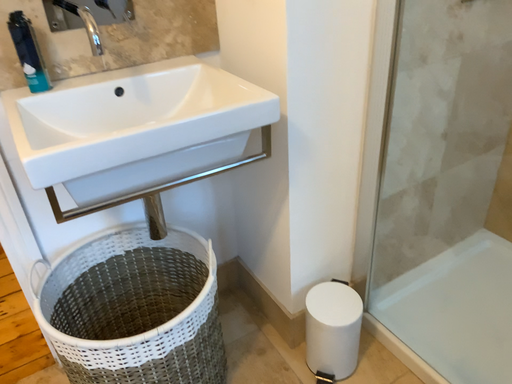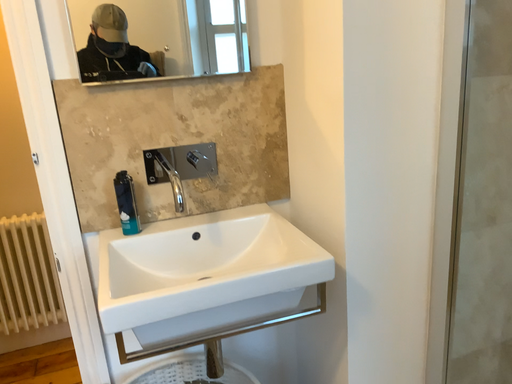
Question: How did the camera likely rotate when shooting the video?

Choices:
 (A) rotated upward
 (B) rotated downward

Answer: (A)